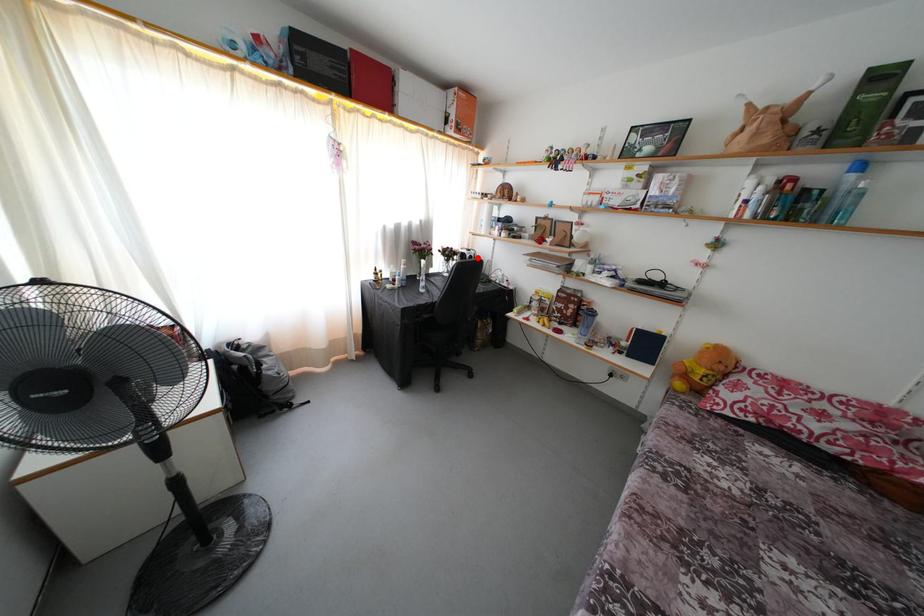
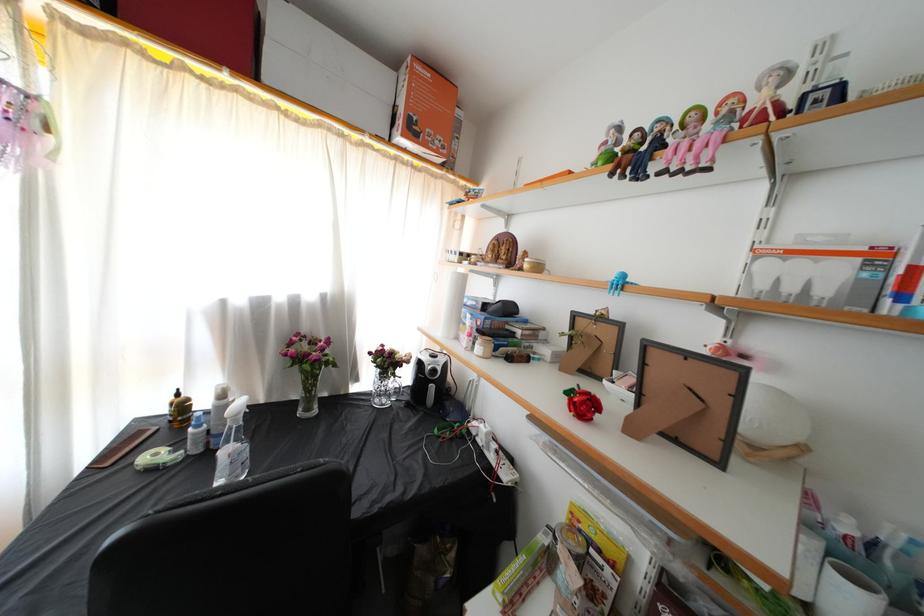
Find the pixel in the second image that matches the highlighted location in the first image.

(446, 365)